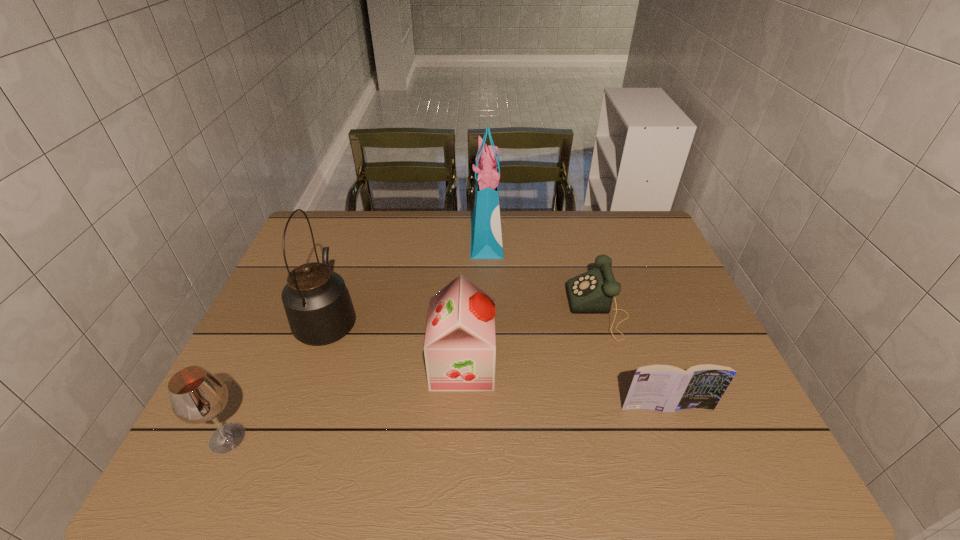
Find the location of `shopping bag`. shopping bag is located at coordinates 486,232.

At what (x,y) coordinates should I click in order to perform the action: click on kettle. Please return your answer as a coordinate pair (x, y). Looking at the image, I should click on (319, 310).

Locate an element on the screen. This screenshot has height=540, width=960. soya milk is located at coordinates (460, 348).

Identify the location of wineglass. The height and width of the screenshot is (540, 960). (197, 396).

What are the coordinates of `the third shortest object` in the screenshot? It's located at (197, 396).

Identify the location of the second shortest object. The image size is (960, 540). (665, 388).

Locate an element on the screen. The image size is (960, 540). the fifth farthest object is located at coordinates (665, 388).

This screenshot has width=960, height=540. Identify the location of the shortest object. (591, 292).

This screenshot has width=960, height=540. Identify the location of free space located on the right of the farthest object. (517, 237).

I want to click on blank space located spout on the kettle, so click(x=363, y=222).